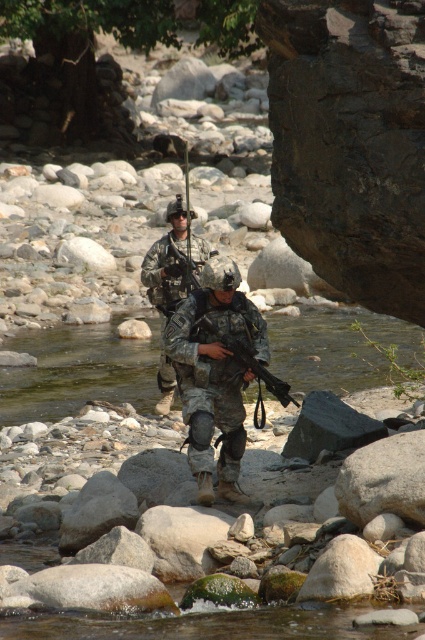
You are a photographer aiming to capture both soldiers in the scene. Since the camouflage fabric uniform at center and the camouflage uniform at center are both in the frame, which one is positioned lower in the image?

The camouflage fabric uniform at center is positioned lower in the image than the camouflage uniform at center.

You are a photographer aiming to capture the soldiers in the scene. Since the camouflage fabric uniform at center and the camouflage uniform at center are both in focus, which one will appear more detailed in the photo?

The camouflage fabric uniform at center will appear more detailed in the photo because it is thinner than the camouflage uniform at center, making it easier to capture finer details.